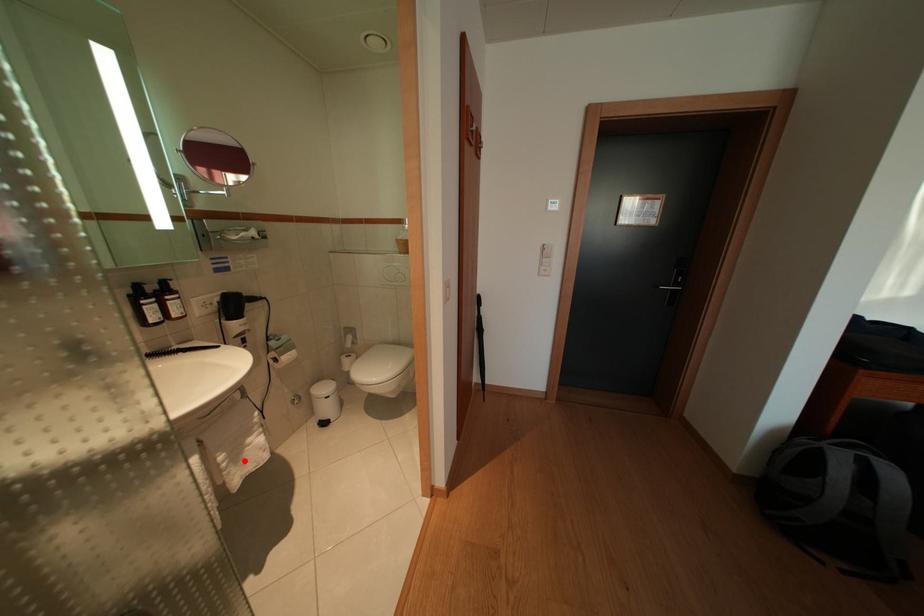
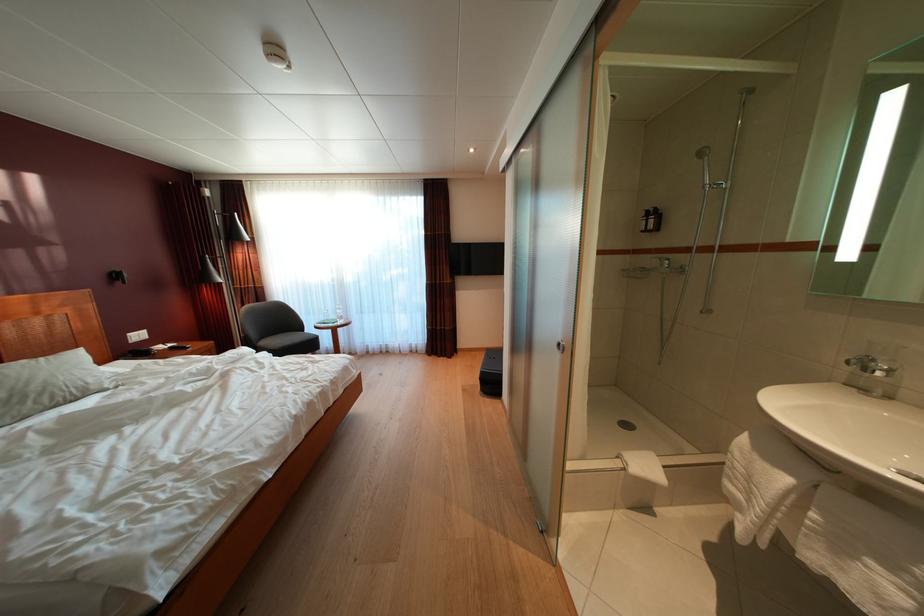
Find the pixel in the second image that matches the highlighted location in the first image.

(849, 554)